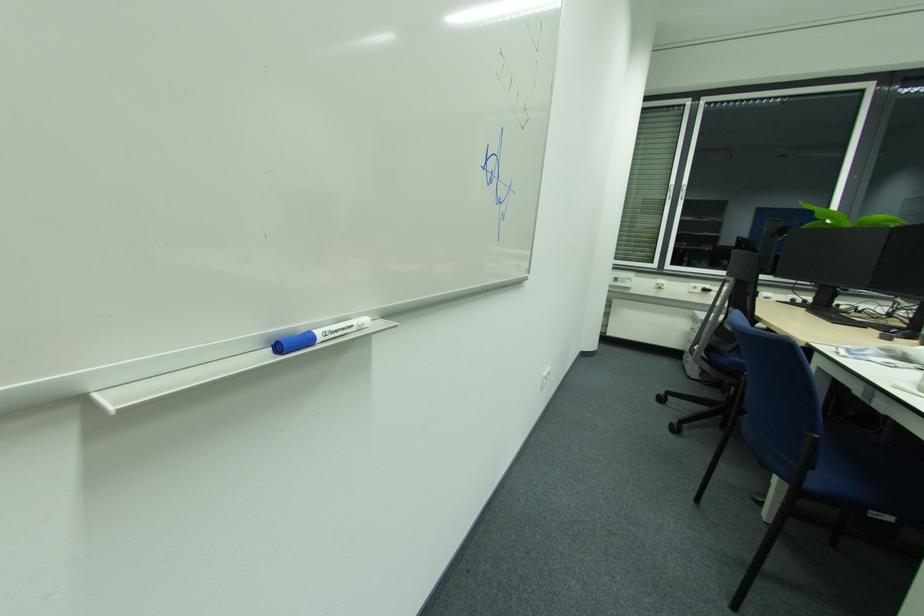
Locate an element on the screen. blue chair sitting surface is located at coordinates (862, 472).